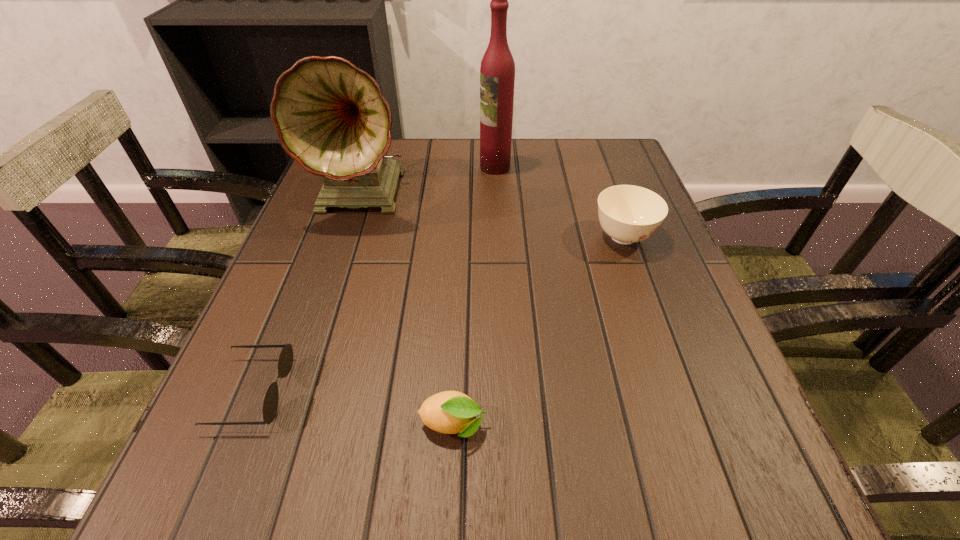
Locate an element on the screen. This screenshot has width=960, height=540. liquor is located at coordinates 497,72.

Identify the location of record player. (331, 117).

Where is `the third shortest object`? This screenshot has height=540, width=960. the third shortest object is located at coordinates click(628, 214).

Where is `sugar bowl`? The image size is (960, 540). sugar bowl is located at coordinates (628, 214).

This screenshot has height=540, width=960. I want to click on lemon, so click(449, 412).

Locate an element on the screen. This screenshot has width=960, height=540. the shortest object is located at coordinates (270, 405).

Find the location of `free space located 0.160m on the label of the liquor`. free space located 0.160m on the label of the liquor is located at coordinates (419, 167).

At what (x,y) coordinates should I click in order to perform the action: click on free spot located 0.090m on the label of the liquor. Please return your answer as a coordinate pair (x, y). Looking at the image, I should click on (445, 167).

Locate an element on the screen. The height and width of the screenshot is (540, 960). vacant space positioned on the label of the liquor is located at coordinates (445, 167).

Identify the location of vacant space located from the horn of the record player. (319, 341).